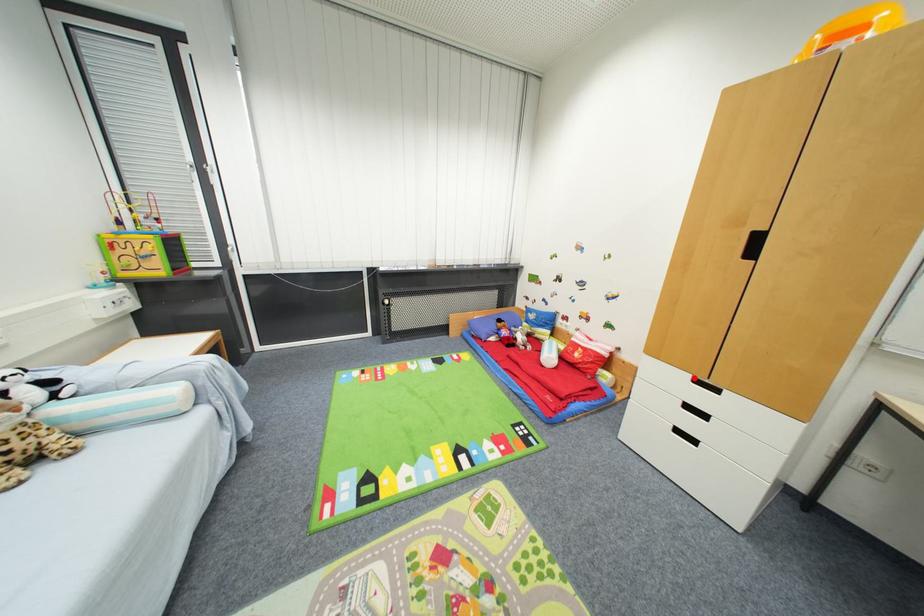
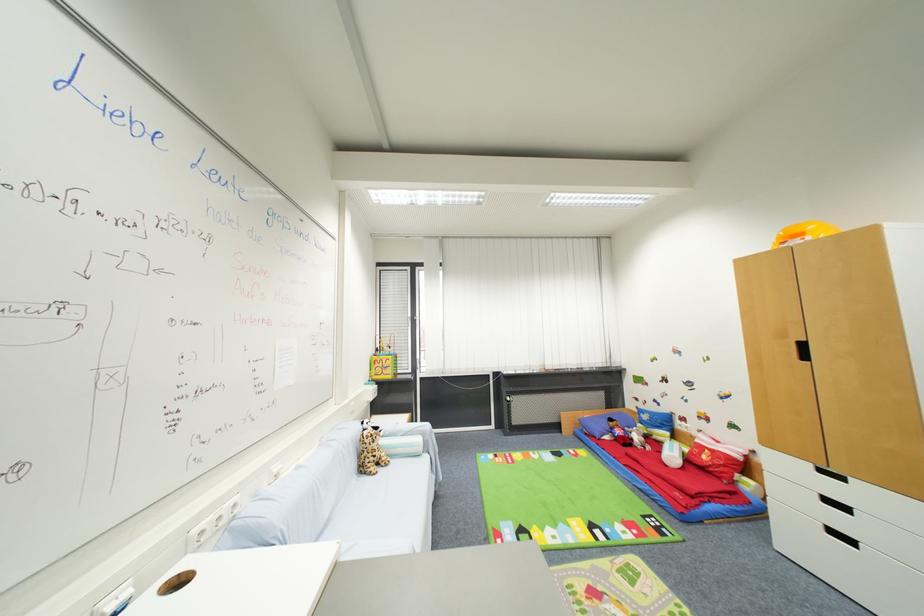
Where in the second image is the point corresponding to the highlighted location from the first image?

(816, 467)